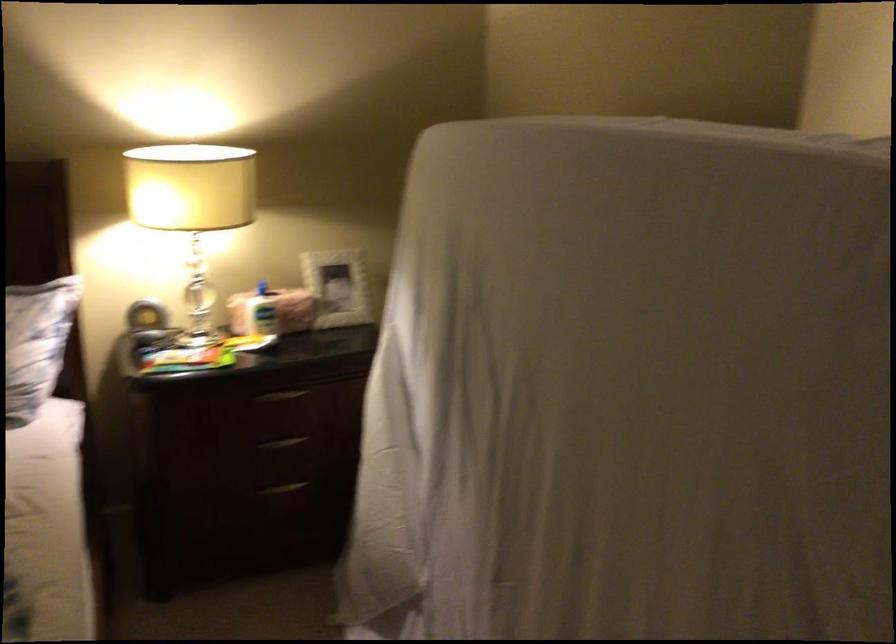
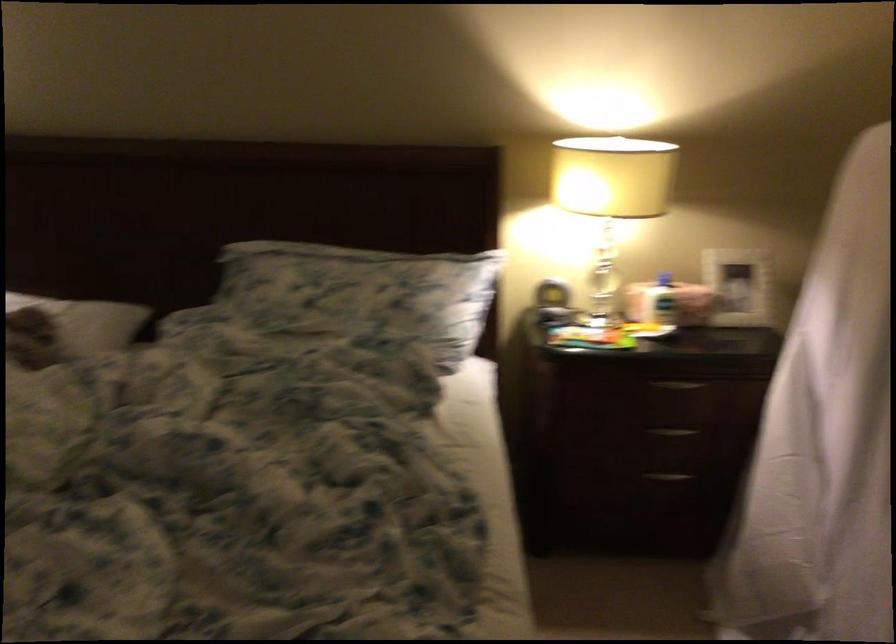
In the second image, find the point that corresponds to (280,446) in the first image.

(672, 431)